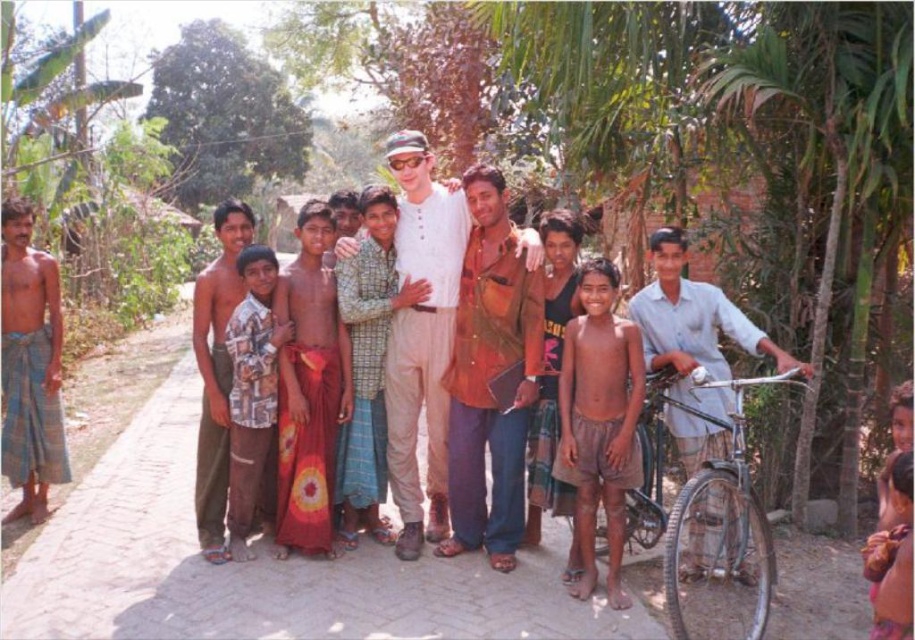
Question: In this image, where is brown leather jacket at center located relative to light beige cotton pants at center?

Choices:
 (A) below
 (B) above

Answer: (A)

Question: Which of the following is the farthest from the observer?

Choices:
 (A) (224, 240)
 (B) (623, 419)

Answer: (A)

Question: Is brown leather jacket at center thinner than silver metallic bicycle at right?

Choices:
 (A) no
 (B) yes

Answer: (B)

Question: Which of the following is the farthest from the observer?

Choices:
 (A) printed cotton shirt at center
 (B) light beige cotton pants at center

Answer: (B)

Question: Which of the following is the closest to the observer?

Choices:
 (A) (580, 465)
 (B) (450, 522)

Answer: (A)

Question: In this image, where is brown cotton shorts at center located relative to silver metallic bicycle at right?

Choices:
 (A) right
 (B) left

Answer: (B)